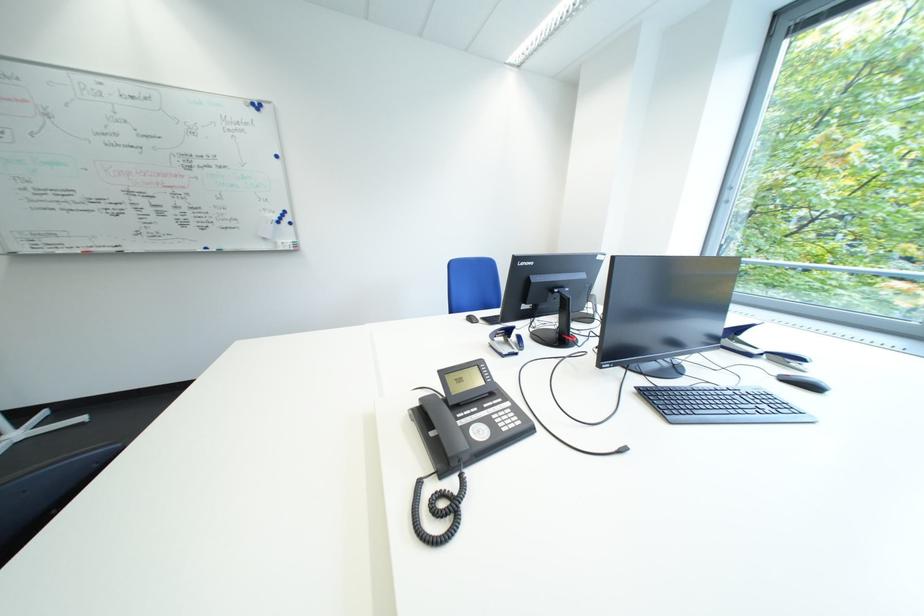
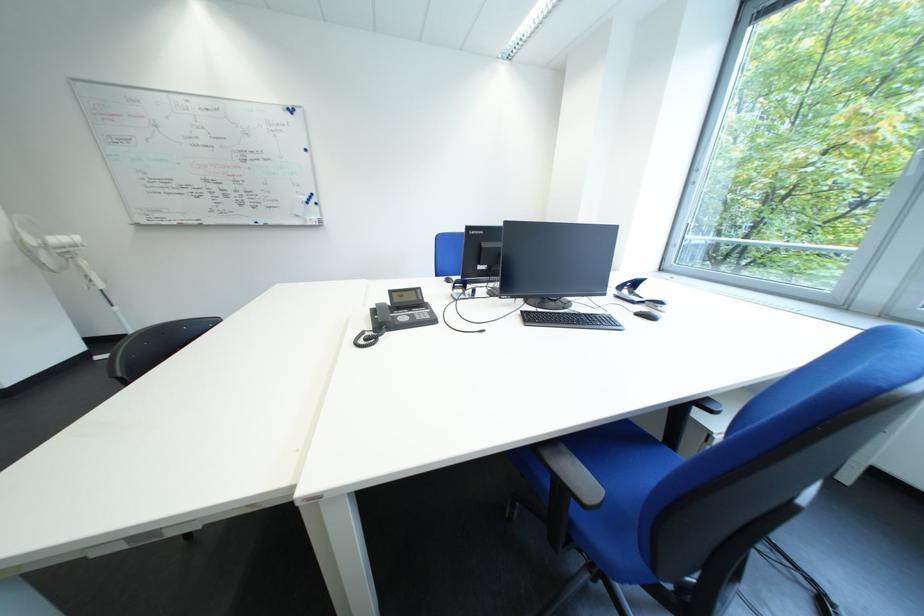
The point at [41,254] is marked in the first image. Where is the corresponding point in the second image?

(157, 225)